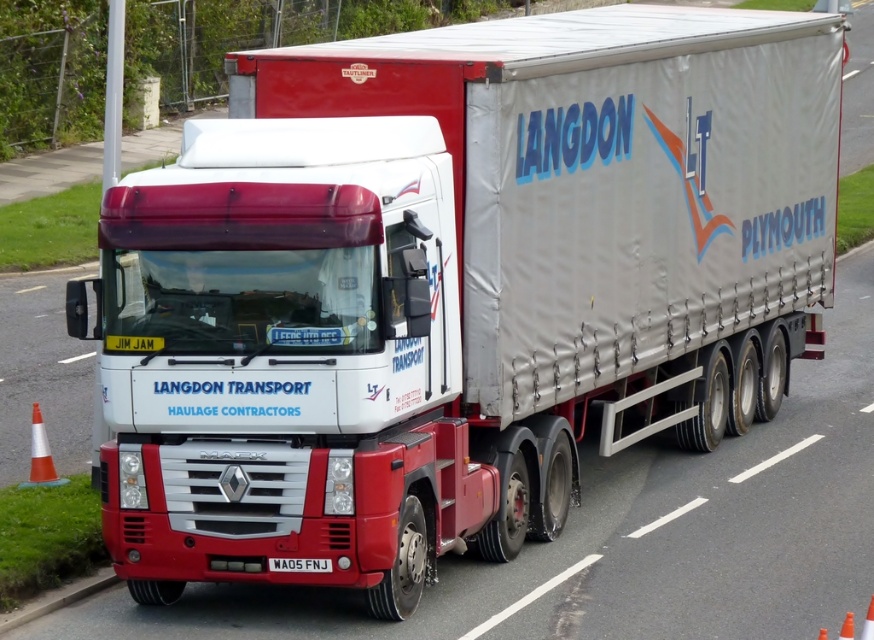
You are a delivery driver approaching a construction zone. You see a Renault truck similar to the one described in the scene. There is a point marked at coordinates (40, 456). What object is located at that point?

At point (40, 456) lies an orange and white plastic traffic cone at lower left.

You are a traffic officer observing the road. You notice the black metal license plate at center and the orange plastic traffic cone at lower right. Which object is positioned higher from the ground?

The black metal license plate at center is above the orange plastic traffic cone at lower right, so it is positioned higher from the ground.